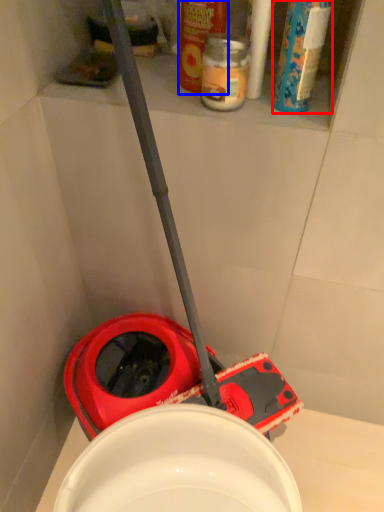
Question: Among these objects, which one is farthest to the camera, cleaning product (highlighted by a red box) or cleaning product (highlighted by a blue box)?

Choices:
 (A) cleaning product
 (B) cleaning product

Answer: (B)